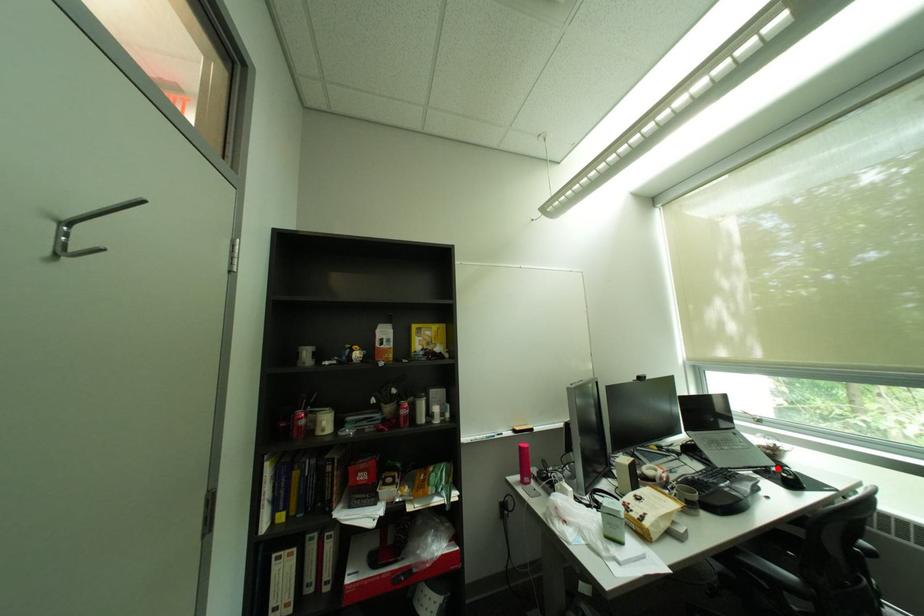
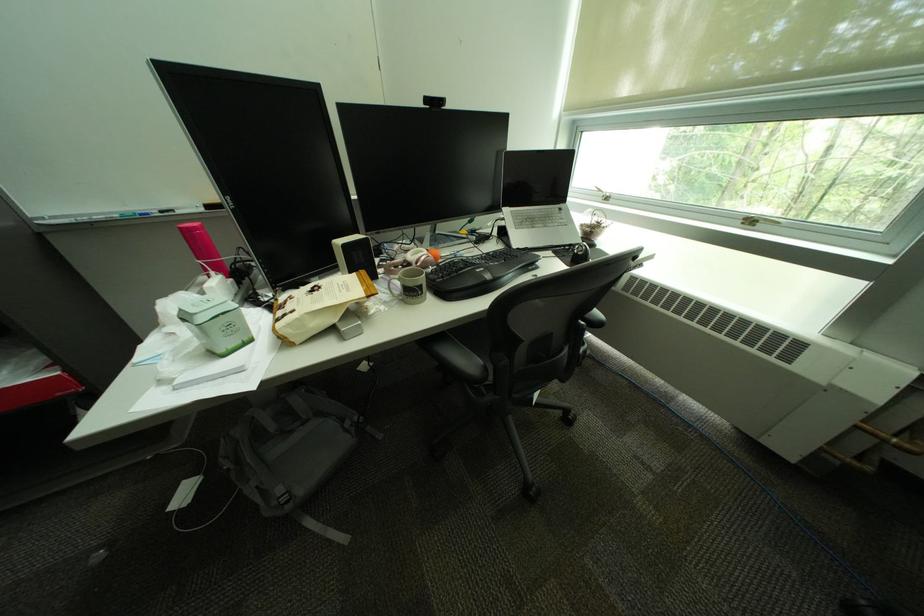
In the second image, find the point that corresponds to the highlighted location in the first image.

(580, 246)